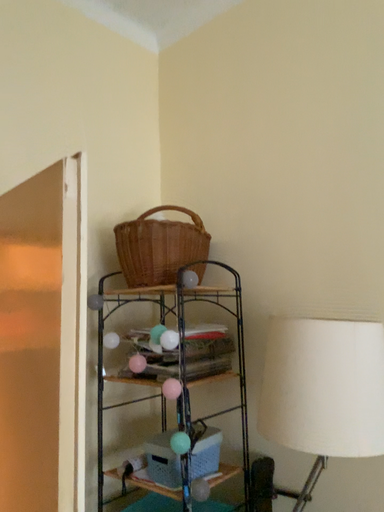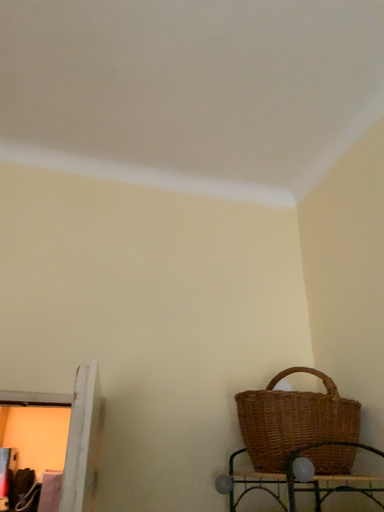
Question: Which way did the camera rotate in the video?

Choices:
 (A) rotated upward
 (B) rotated downward

Answer: (A)